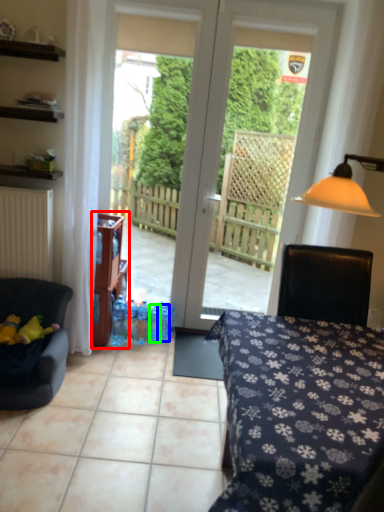
Question: Estimate the real-world distances between objects in this image. Which object is closer to shelf (highlighted by a red box), bottle (highlighted by a blue box) or bottle (highlighted by a green box)?

Choices:
 (A) bottle
 (B) bottle

Answer: (B)